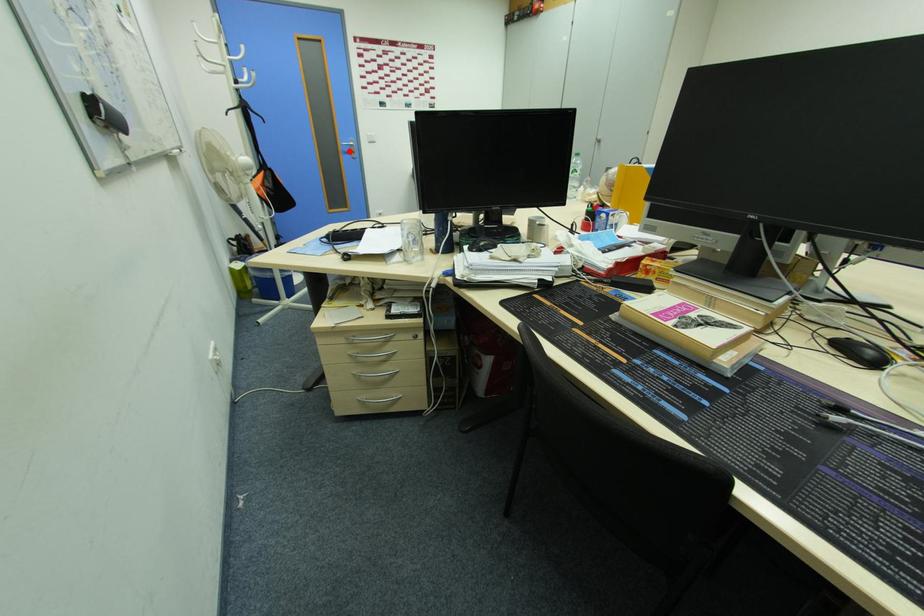
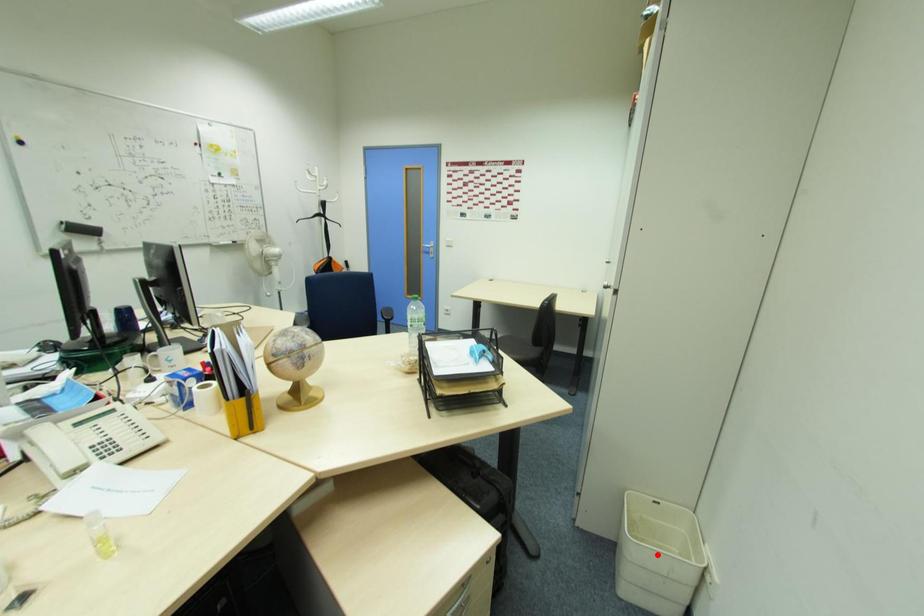
In the scene shown: I am providing you with two images of the same scene from different viewpoints. A red point is marked on the first image and another point is marked on the second image. Is the red point in image1 aligned with the point shown in image2?

No